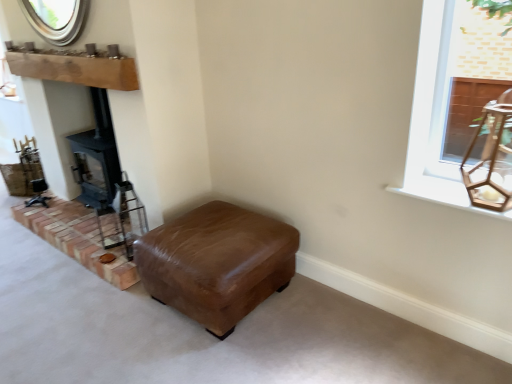
Question: From a real-world perspective, is natural wood mantle at upper left positioned over brown leather ottoman at center based on gravity?

Choices:
 (A) no
 (B) yes

Answer: (B)

Question: From a real-world perspective, does natural wood mantle at upper left sit lower than brown leather ottoman at center?

Choices:
 (A) yes
 (B) no

Answer: (B)

Question: Is natural wood mantle at upper left in front of brown leather ottoman at center?

Choices:
 (A) no
 (B) yes

Answer: (A)

Question: Does natural wood mantle at upper left have a greater height compared to brown leather ottoman at center?

Choices:
 (A) no
 (B) yes

Answer: (A)

Question: Considering the relative sizes of natural wood mantle at upper left and brown leather ottoman at center in the image provided, is natural wood mantle at upper left wider than brown leather ottoman at center?

Choices:
 (A) yes
 (B) no

Answer: (B)

Question: From a real-world perspective, is natural wood mantle at upper left positioned above or below white wood window sill at upper right?

Choices:
 (A) above
 (B) below

Answer: (A)

Question: Considering the positions of natural wood mantle at upper left and white wood window sill at upper right in the image, is natural wood mantle at upper left taller or shorter than white wood window sill at upper right?

Choices:
 (A) tall
 (B) short

Answer: (A)

Question: Is natural wood mantle at upper left inside or outside of white wood window sill at upper right?

Choices:
 (A) inside
 (B) outside

Answer: (B)

Question: In the image, is natural wood mantle at upper left on the left side or the right side of white wood window sill at upper right?

Choices:
 (A) right
 (B) left

Answer: (B)

Question: From a real-world perspective, relative to natural wood mantle at upper left, is brown brickwork at lower left vertically above or below?

Choices:
 (A) below
 (B) above

Answer: (A)

Question: Visually, is brown brickwork at lower left positioned to the left or to the right of natural wood mantle at upper left?

Choices:
 (A) right
 (B) left

Answer: (A)

Question: From the image's perspective, is brown brickwork at lower left above or below natural wood mantle at upper left?

Choices:
 (A) above
 (B) below

Answer: (B)

Question: Considering the positions of point pyautogui.click(x=114, y=281) and point pyautogui.click(x=74, y=77), is point pyautogui.click(x=114, y=281) closer or farther from the camera than point pyautogui.click(x=74, y=77)?

Choices:
 (A) farther
 (B) closer

Answer: (B)

Question: From a real-world perspective, is brown brickwork at lower left positioned above or below white wood window sill at upper right?

Choices:
 (A) above
 (B) below

Answer: (B)

Question: Considering the positions of brown brickwork at lower left and white wood window sill at upper right in the image, is brown brickwork at lower left taller or shorter than white wood window sill at upper right?

Choices:
 (A) tall
 (B) short

Answer: (A)